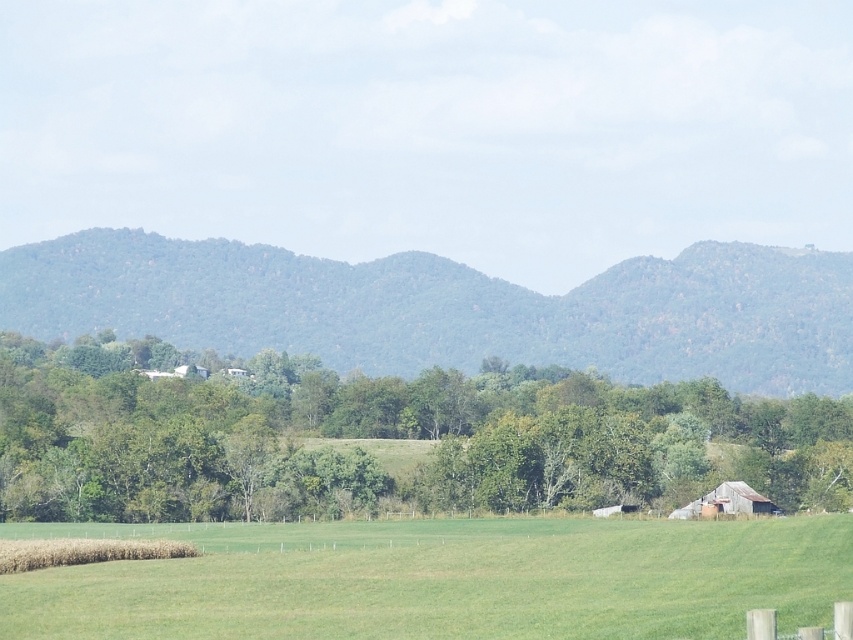
You are a hiker standing in the middle of the green leafy forest at center and want to see the distant mountains. Can you see the distant mountains through the green leafy tree at center?

The green leafy tree at center is shorter than the green leafy forest at center, so yes, you can see the distant mountains through the green leafy tree at center because it is shorter than the surrounding forest.

In the scene shown: You are a gardener standing at the edge of the green grassy field at lower center and want to water the green leafy tree at center. Which direction should you move to reach the tree?

The green leafy tree at center is to the left of the green grassy field at lower center, so you should move to the left to reach the tree.

You are a farmer checking the irrigation system. You need to determine if the green leafy tree at center requires more water. The tree needs to be taller than the green grassy field at lower center to indicate adequate growth. Is the tree taller than the field?

The green leafy tree at center is shorter than green grassy field at lower center, so it may require more water to reach the necessary height for adequate growth.